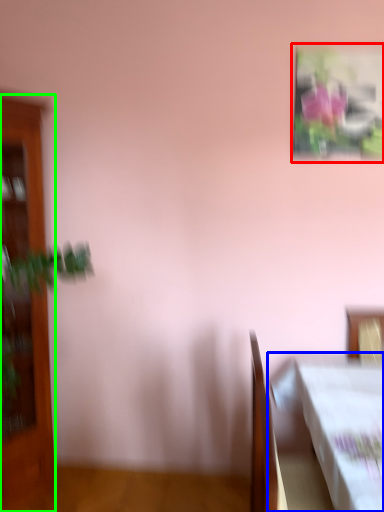
Question: Which object is the closest to the picture frame (highlighted by a red box)? Choose among these: table (highlighted by a blue box) or furniture (highlighted by a green box).

Choices:
 (A) table
 (B) furniture

Answer: (A)